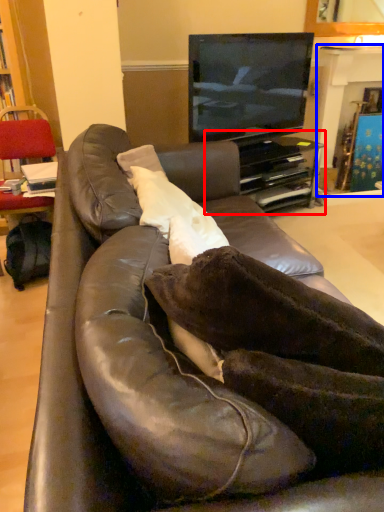
Question: Which of the following is the farthest to the observer, entertainment center (highlighted by a red box) or fireplace (highlighted by a blue box)?

Choices:
 (A) entertainment center
 (B) fireplace

Answer: (B)